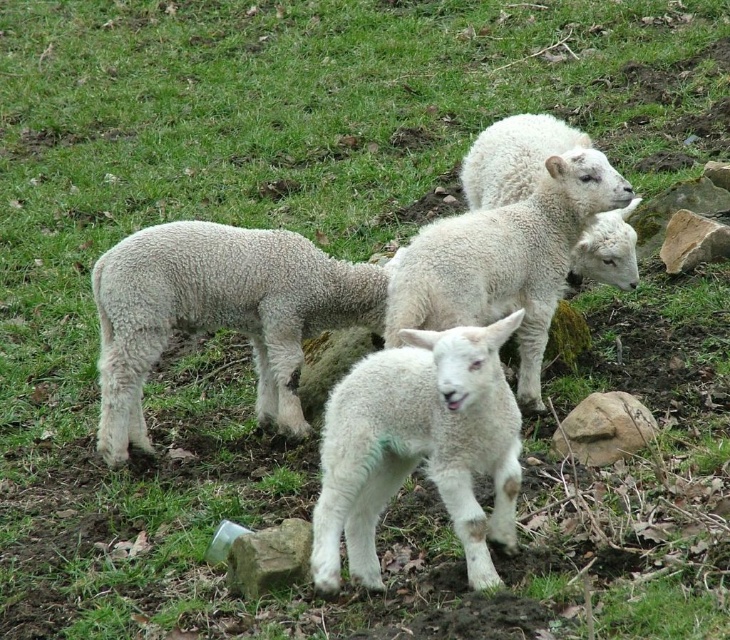
Find the location of a particular element. Image resolution: width=730 pixels, height=640 pixels. white woolen lamb at center is located at coordinates (219, 312).

The height and width of the screenshot is (640, 730). In order to click on white woolen lamb at center in this screenshot , I will do `click(219, 312)`.

Identify the location of white woolen lamb at center. (219, 312).

From the picture: Does white woolen lamb at center have a greater width compared to white woolen sheep at upper right?

Yes.

What do you see at coordinates (219, 312) in the screenshot? I see `white woolen lamb at center` at bounding box center [219, 312].

What do you see at coordinates (219, 312) in the screenshot? I see `white woolen lamb at center` at bounding box center [219, 312].

The image size is (730, 640). In order to click on white woolen lamb at center in this screenshot , I will do `click(219, 312)`.

Does white fluffy lamb at center appear on the right side of green mossy rock at lower center?

Yes, white fluffy lamb at center is to the right of green mossy rock at lower center.

Is white fluffy lamb at center wider than green mossy rock at lower center?

Yes.

This screenshot has width=730, height=640. Identify the location of white fluffy lamb at center. (418, 448).